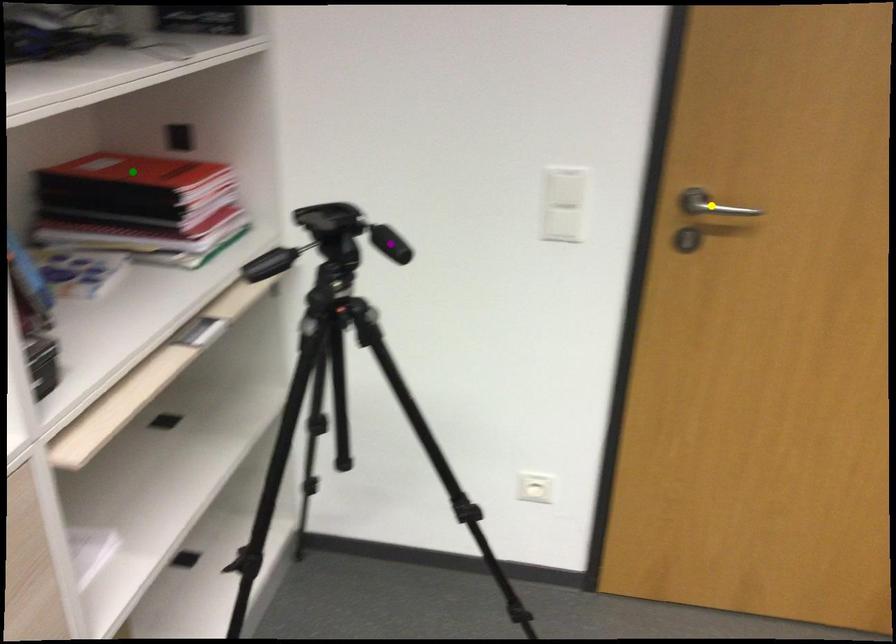
Order these from nearest to farthest:
1. purple point
2. yellow point
3. green point

1. green point
2. yellow point
3. purple point